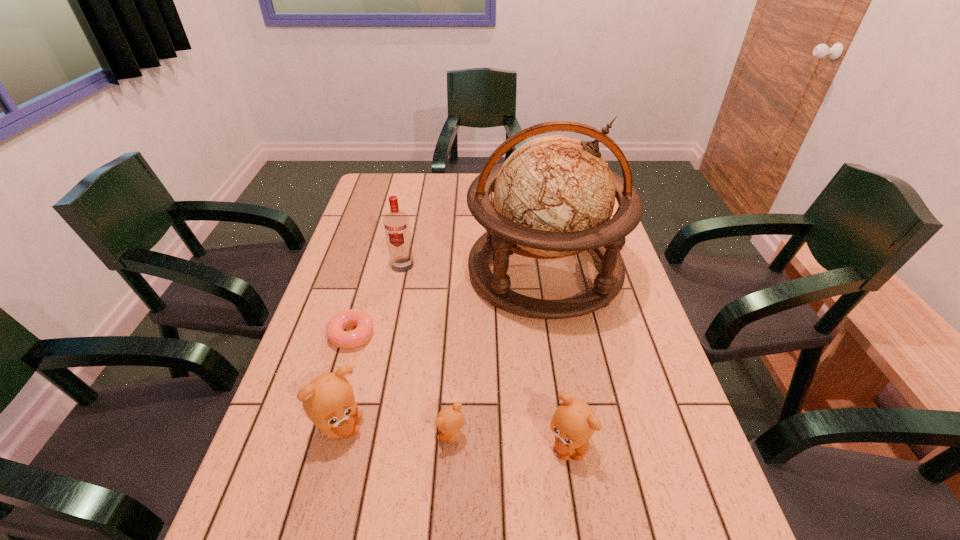
Where is `vacant area situated on the face of the shortest teddy bear`? vacant area situated on the face of the shortest teddy bear is located at coordinates (287, 436).

Find the location of a particular element. This screenshot has height=540, width=960. free space located 0.120m on the face of the shortest teddy bear is located at coordinates (381, 436).

Where is `free point located 0.200m on the front label of the vodka`? This screenshot has height=540, width=960. free point located 0.200m on the front label of the vodka is located at coordinates (391, 321).

Where is `vacant point located 0.220m on the back of the globe`? This screenshot has width=960, height=540. vacant point located 0.220m on the back of the globe is located at coordinates (531, 195).

Where is `free space located 0.140m on the back of the doughnut`? This screenshot has height=540, width=960. free space located 0.140m on the back of the doughnut is located at coordinates (367, 284).

In order to click on teddy bear that is at the left edge in this screenshot , I will do `click(329, 402)`.

You are a GUI agent. You are given a task and a screenshot of the screen. Output one action in this format:
    pyautogui.click(x=<x>, y=<y>)
    Task: Click on the doughnut that is at the left edge
    
    Given the screenshot: What is the action you would take?
    pyautogui.click(x=335, y=332)

Find the location of a particular element. The height and width of the screenshot is (540, 960). object that is at the right edge is located at coordinates (554, 196).

This screenshot has height=540, width=960. I want to click on vacant space at the far edge, so click(420, 204).

Where is `vacant space at the near edge`? This screenshot has width=960, height=540. vacant space at the near edge is located at coordinates (518, 472).